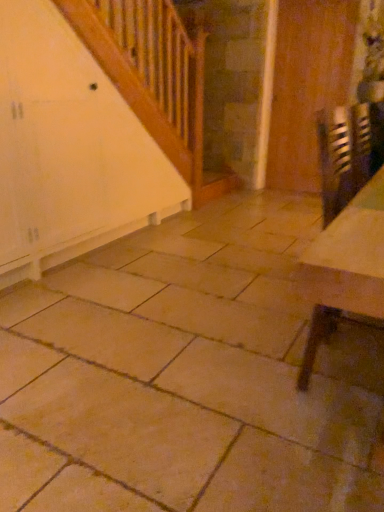
This screenshot has width=384, height=512. What are the coordinates of `wooden door at right` in the screenshot? It's located at (307, 85).

Describe the element at coordinates (307, 85) in the screenshot. I see `wooden door at right` at that location.

The height and width of the screenshot is (512, 384). I want to click on metallic reflective table at lower right, so click(x=346, y=271).

Describe the element at coordinates (346, 271) in the screenshot. I see `metallic reflective table at lower right` at that location.

Image resolution: width=384 pixels, height=512 pixels. In order to click on wooden door at right in this screenshot , I will do `click(307, 85)`.

Visually, is wooden door at right positioned to the left or to the right of metallic reflective table at lower right?

wooden door at right is positioned on metallic reflective table at lower right's right side.

Which object is more forward, wooden door at right or metallic reflective table at lower right?

metallic reflective table at lower right is more forward.

Does point (337, 57) lie in front of point (339, 317)?

No, (337, 57) is behind (339, 317).

From the image's perspective, is wooden door at right above or below metallic reflective table at lower right?

From the image's perspective, wooden door at right appears above metallic reflective table at lower right.

From a real-world perspective, is wooden door at right located higher than metallic reflective table at lower right?

Yes, from a real-world perspective, wooden door at right is on top of metallic reflective table at lower right.

Considering the sizes of wooden door at right and metallic reflective table at lower right in the image, is wooden door at right wider or thinner than metallic reflective table at lower right?

In the image, wooden door at right appears to be more narrow than metallic reflective table at lower right.

Is wooden door at right shorter than metallic reflective table at lower right?

No, wooden door at right is not shorter than metallic reflective table at lower right.

Does wooden door at right have a larger size compared to metallic reflective table at lower right?

No, wooden door at right is not bigger than metallic reflective table at lower right.

Could metallic reflective table at lower right be considered to be inside wooden door at right?

No, wooden door at right does not contain metallic reflective table at lower right.

Is wooden door at right in contact with metallic reflective table at lower right?

wooden door at right and metallic reflective table at lower right are not in contact.

Is wooden door at right facing towards metallic reflective table at lower right?

Yes, wooden door at right is oriented towards metallic reflective table at lower right.

Locate an element on the screen. The width and height of the screenshot is (384, 512). door behind the metallic reflective table at lower right is located at coordinates (307, 85).

Would you say metallic reflective table at lower right is to the left or to the right of wooden door at right in the picture?

Based on their positions, metallic reflective table at lower right is located to the left of wooden door at right.

Between metallic reflective table at lower right and wooden door at right, which one is positioned behind?

wooden door at right is further away from the camera.

Between point (363, 195) and point (278, 96), which one is positioned in front?

The point (363, 195) is more forward.

From the image's perspective, is metallic reflective table at lower right above wooden door at right?

No, from the image's perspective, metallic reflective table at lower right is not over wooden door at right.

From a real-world perspective, is metallic reflective table at lower right physically above wooden door at right?

No.

In terms of width, does metallic reflective table at lower right look wider or thinner when compared to wooden door at right?

metallic reflective table at lower right is wider than wooden door at right.

Between metallic reflective table at lower right and wooden door at right, which one has less height?

Standing shorter between the two is metallic reflective table at lower right.

Considering the relative sizes of metallic reflective table at lower right and wooden door at right in the image provided, is metallic reflective table at lower right smaller than wooden door at right?

Incorrect, metallic reflective table at lower right is not smaller in size than wooden door at right.

Is metallic reflective table at lower right outside of wooden door at right?

Absolutely, metallic reflective table at lower right is external to wooden door at right.

Is metallic reflective table at lower right positioned far away from wooden door at right?

Yes.

Could you tell me if metallic reflective table at lower right is turned towards wooden door at right?

No.

How different are the orientations of metallic reflective table at lower right and wooden door at right in degrees?

There is a 90.1-degree angle between the facing directions of metallic reflective table at lower right and wooden door at right.

How far apart are metallic reflective table at lower right and wooden door at right?

metallic reflective table at lower right and wooden door at right are 3.49 meters apart from each other.

Locate an element on the screen. This screenshot has height=512, width=384. door above the metallic reflective table at lower right (from the image's perspective) is located at coordinates (307, 85).

I want to click on door above the metallic reflective table at lower right (from a real-world perspective), so (x=307, y=85).

Locate an element on the screen. The image size is (384, 512). door behind the metallic reflective table at lower right is located at coordinates (307, 85).